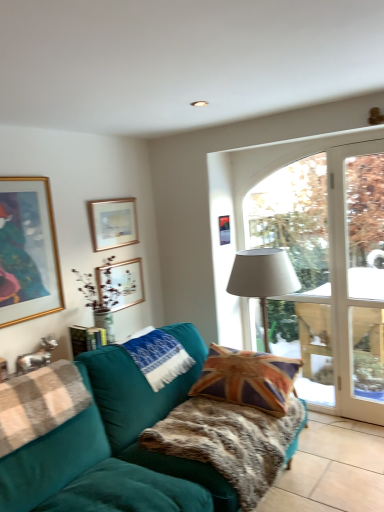
Question: In terms of height, does metallic gold picture frame at upper center, placed as the 1th picture frame when sorted from right to left, look taller or shorter compared to matte gold picture frame at upper center, which is counted as the 2th picture frame, starting from the left?

Choices:
 (A) short
 (B) tall

Answer: (A)

Question: In the image, is metallic gold picture frame at upper center, acting as the 4th picture frame starting from the left, on the left side or the right side of matte gold picture frame at upper center, which is counted as the 2th picture frame, starting from the left?

Choices:
 (A) left
 (B) right

Answer: (B)

Question: Considering the real-world distances, which object is closest to the teal velvet couch at lower left?

Choices:
 (A) white glass door at right
 (B) metallic gold picture frame at upper center, acting as the 4th picture frame starting from the left
 (C) matte gold picture frame at upper center, which is counted as the 2th picture frame, starting from the left
 (D) union jack fabric pillow at center, which appears as the 1th pillow when viewed from the right
 (E) fur-like teal blanket at center

Answer: (E)

Question: Which object is positioned farthest from the white fabric lampshade at center?

Choices:
 (A) metallic gold picture frame at upper center, acting as the 4th picture frame starting from the left
 (B) gold-framed picture at upper left, positioned as the fourth picture frame in right-to-left order
 (C) matte gold picture frame at upper center, the 3th picture frame positioned from the right
 (D) transparent glass door at center
 (E) fur-like teal blanket at center

Answer: (B)